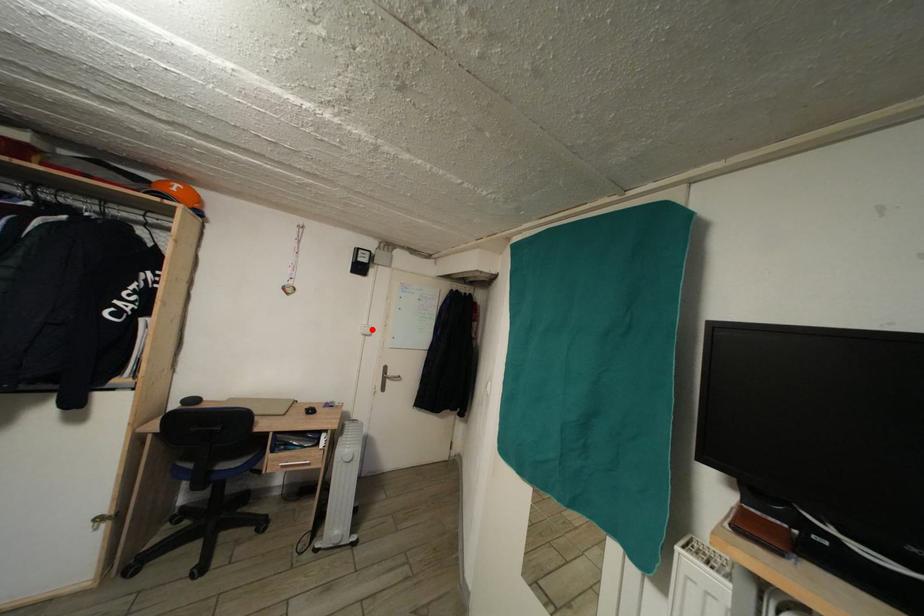
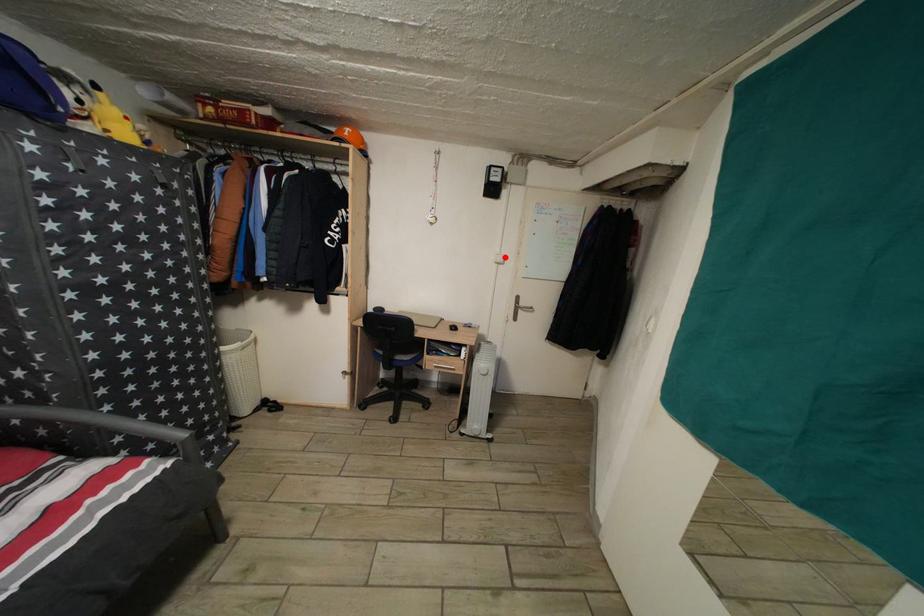
I am providing you with two images of the same scene from different viewpoints. A red point is marked on the first image and another point is marked on the second image. Are the points marked in image1 and image2 representing the same 3D position?

Yes